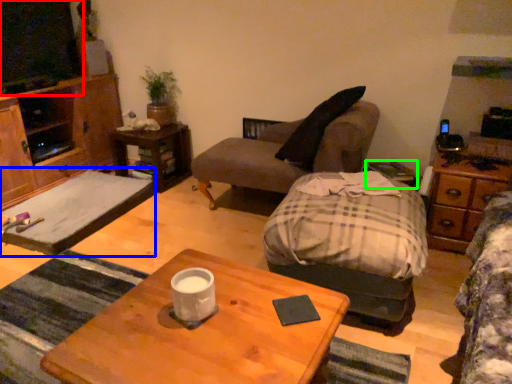
Question: Considering the real-world distances, which object is closest to television (highlighted by a red box)? flat (highlighted by a blue box) or side table (highlighted by a green box).

Choices:
 (A) flat
 (B) side table

Answer: (A)